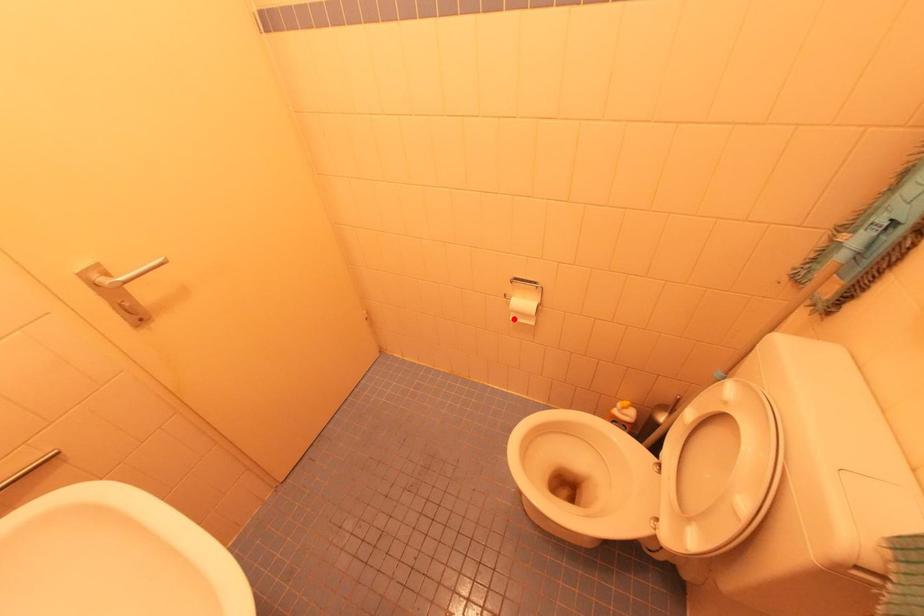
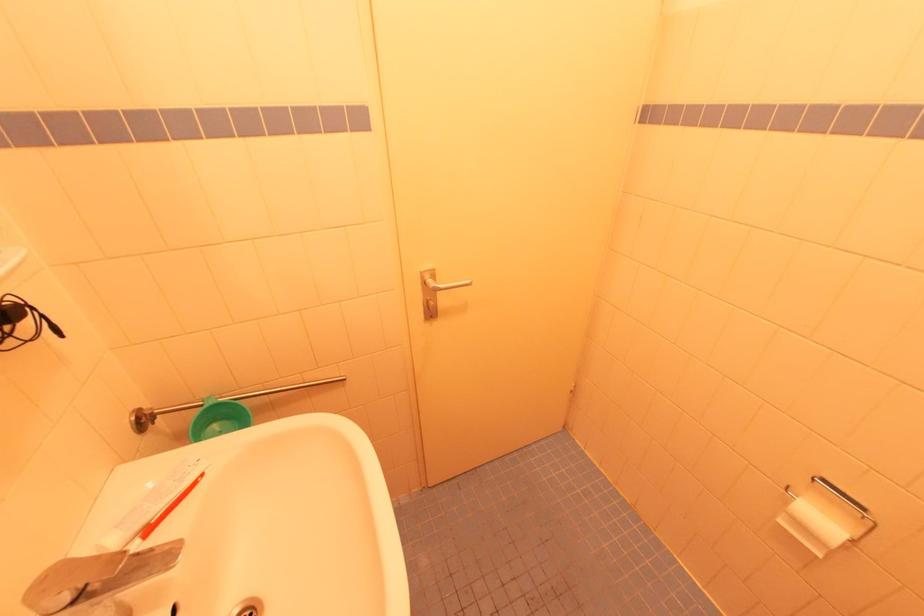
Where in the second image is the point corresponding to the highlighted location from the first image?

(784, 523)